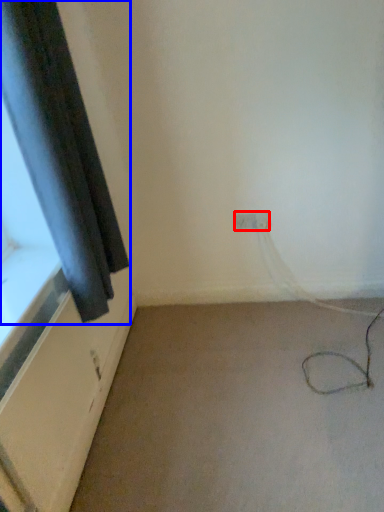
Question: Which of the following is the closest to the observer, electric outlet (highlighted by a red box) or curtain (highlighted by a blue box)?

Choices:
 (A) electric outlet
 (B) curtain

Answer: (B)